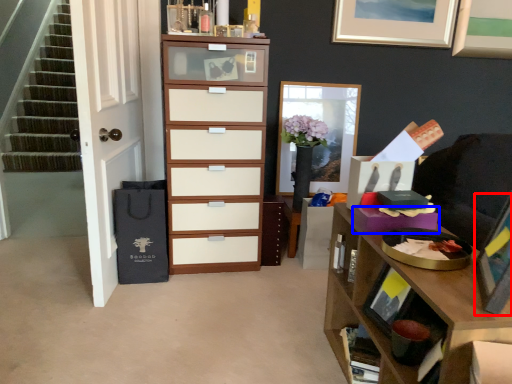
Question: Which object is closer to the camera taking this photo, picture frame (highlighted by a red box) or drawer (highlighted by a blue box)?

Choices:
 (A) picture frame
 (B) drawer

Answer: (A)